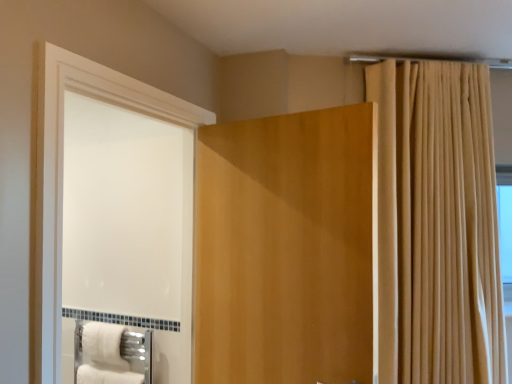
Question: In the image, is matte wood door at center on the left side or the right side of beige fabric curtain at upper right?

Choices:
 (A) left
 (B) right

Answer: (A)

Question: Which is correct: matte wood door at center is inside beige fabric curtain at upper right, or outside of it?

Choices:
 (A) outside
 (B) inside

Answer: (A)

Question: Which is farther from the matte wood door at center?

Choices:
 (A) white fluffy bath towel at lower left
 (B) white glossy screen door at left
 (C) beige fabric curtain at upper right

Answer: (A)

Question: Which is nearer to the matte wood door at center?

Choices:
 (A) white fluffy bath towel at lower left
 (B) white glossy screen door at left
 (C) beige fabric curtain at upper right

Answer: (B)